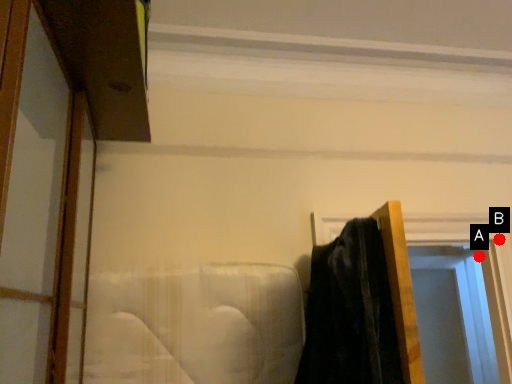
Question: Two points are circled on the image, labeled by A and B beside each circle. Which point is closer to the camera?

Choices:
 (A) A is closer
 (B) B is closer

Answer: (B)